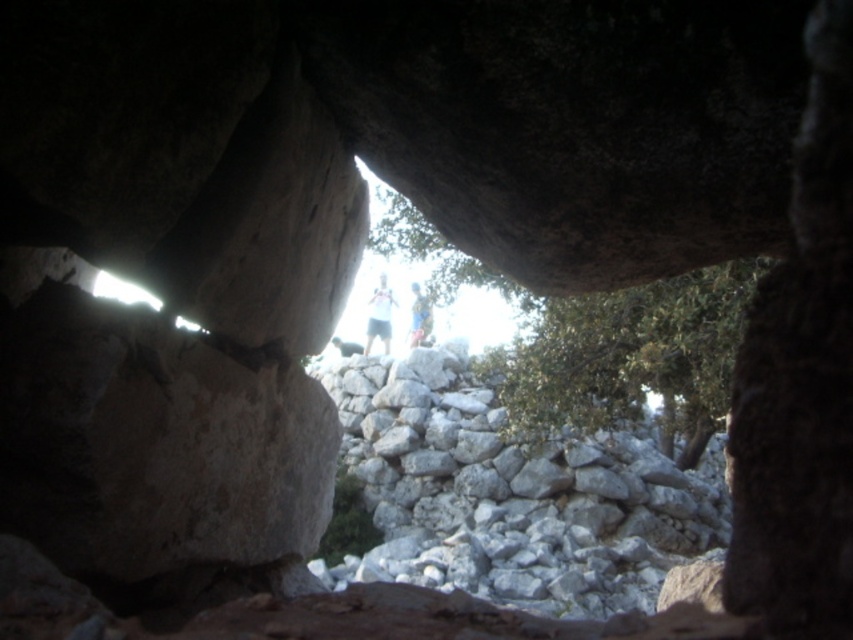
Does gray rough stone wall at center have a greater width compared to blue fabric at center?

Correct, the width of gray rough stone wall at center exceeds that of blue fabric at center.

Is point (434, 557) less distant than point (410, 310)?

Yes, it is.

Identify the location of gray rough stone wall at center. The image size is (853, 640). (509, 493).

Who is taller, green leafy tree at center or white cotton shirt at center?

green leafy tree at center is taller.

Who is higher up, green leafy tree at center or white cotton shirt at center?

Positioned higher is white cotton shirt at center.

Where is `green leafy tree at center`? The width and height of the screenshot is (853, 640). green leafy tree at center is located at coordinates (627, 356).

Is gray rough stone wall at center thinner than green leafy tree at center?

No.

Can you confirm if gray rough stone wall at center is positioned to the right of green leafy tree at center?

In fact, gray rough stone wall at center is to the left of green leafy tree at center.

Describe the element at coordinates (509, 493) in the screenshot. Image resolution: width=853 pixels, height=640 pixels. I see `gray rough stone wall at center` at that location.

At what (x,y) coordinates should I click in order to perform the action: click on gray rough stone wall at center. Please return your answer as a coordinate pair (x, y). The image size is (853, 640). Looking at the image, I should click on (509, 493).